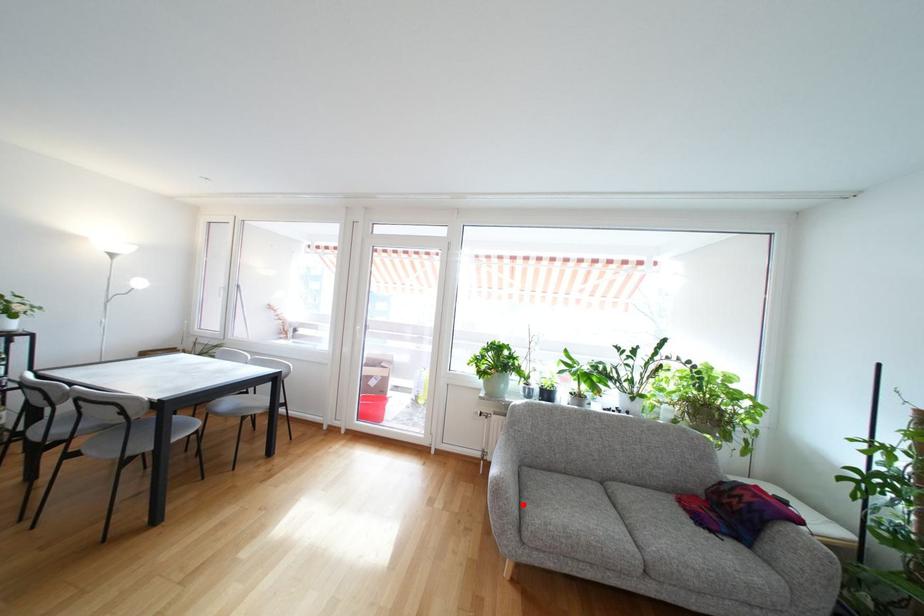
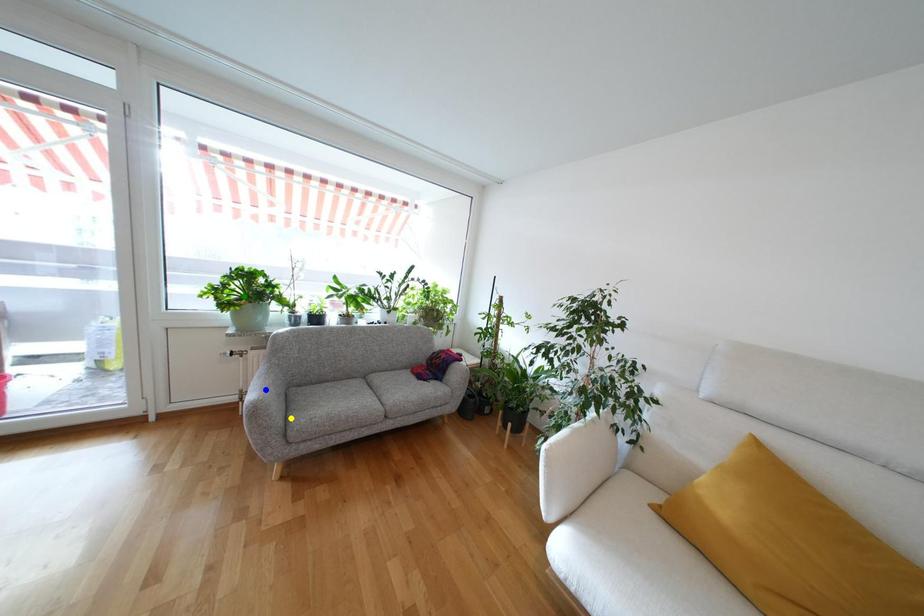
Question: I am providing you with two images of the same scene from different viewpoints. A red point is marked on the first image. You are given multiple points on the second image. Which spot in image 2 lines up with the point in image 1?

Choices:
 (A) green point
 (B) yellow point
 (C) blue point

Answer: (B)